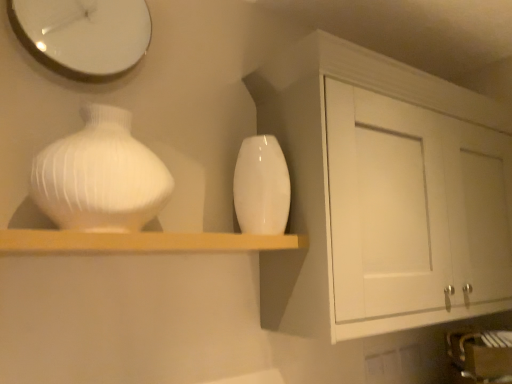
Question: From the image's perspective, is white glossy clock at upper left under glossy ceramic vase at center, positioned as the first vase in back-to-front order?

Choices:
 (A) no
 (B) yes

Answer: (A)

Question: Is white glossy clock at upper left closer to camera compared to glossy ceramic vase at center, positioned as the first vase in back-to-front order?

Choices:
 (A) no
 (B) yes

Answer: (B)

Question: Is white glossy clock at upper left to the right of glossy ceramic vase at center, the second vase when ordered from left to right, from the viewer's perspective?

Choices:
 (A) yes
 (B) no

Answer: (B)

Question: Can you confirm if white glossy clock at upper left is wider than glossy ceramic vase at center, which ranks as the 1th vase in right-to-left order?

Choices:
 (A) no
 (B) yes

Answer: (A)

Question: From a real-world perspective, is white glossy clock at upper left positioned under glossy ceramic vase at center, which ranks as the 1th vase in right-to-left order, based on gravity?

Choices:
 (A) no
 (B) yes

Answer: (A)

Question: Is point (479, 210) closer or farther from the camera than point (241, 190)?

Choices:
 (A) farther
 (B) closer

Answer: (A)

Question: Which is correct: white matte cabinet at upper right is inside glossy ceramic vase at center, which ranks as the 1th vase in right-to-left order, or outside of it?

Choices:
 (A) outside
 (B) inside

Answer: (A)

Question: Would you say white matte cabinet at upper right is to the left or to the right of glossy ceramic vase at center, which ranks as the 1th vase in right-to-left order, in the picture?

Choices:
 (A) right
 (B) left

Answer: (A)

Question: Is white matte cabinet at upper right in front of or behind glossy ceramic vase at center, the second vase when ordered from left to right, in the image?

Choices:
 (A) front
 (B) behind

Answer: (A)

Question: Considering the positions of glossy ceramic vase at center, the second vase positioned from the front, and wooden shelf at center in the image, is glossy ceramic vase at center, the second vase positioned from the front, wider or thinner than wooden shelf at center?

Choices:
 (A) wide
 (B) thin

Answer: (B)

Question: Considering the positions of glossy ceramic vase at center, the second vase positioned from the front, and wooden shelf at center in the image, is glossy ceramic vase at center, the second vase positioned from the front, taller or shorter than wooden shelf at center?

Choices:
 (A) short
 (B) tall

Answer: (B)

Question: Visually, is glossy ceramic vase at center, positioned as the first vase in back-to-front order, positioned to the left or to the right of wooden shelf at center?

Choices:
 (A) right
 (B) left

Answer: (A)

Question: Is glossy ceramic vase at center, the second vase positioned from the front, bigger or smaller than wooden shelf at center?

Choices:
 (A) big
 (B) small

Answer: (B)

Question: In the image, is glossy ceramic vase at center, the second vase positioned from the front, positioned in front of or behind white glossy vase at left, acting as the 2th vase starting from the right?

Choices:
 (A) front
 (B) behind

Answer: (B)

Question: Based on their sizes in the image, would you say glossy ceramic vase at center, the second vase when ordered from left to right, is bigger or smaller than white glossy vase at left, acting as the first vase starting from the left?

Choices:
 (A) big
 (B) small

Answer: (B)